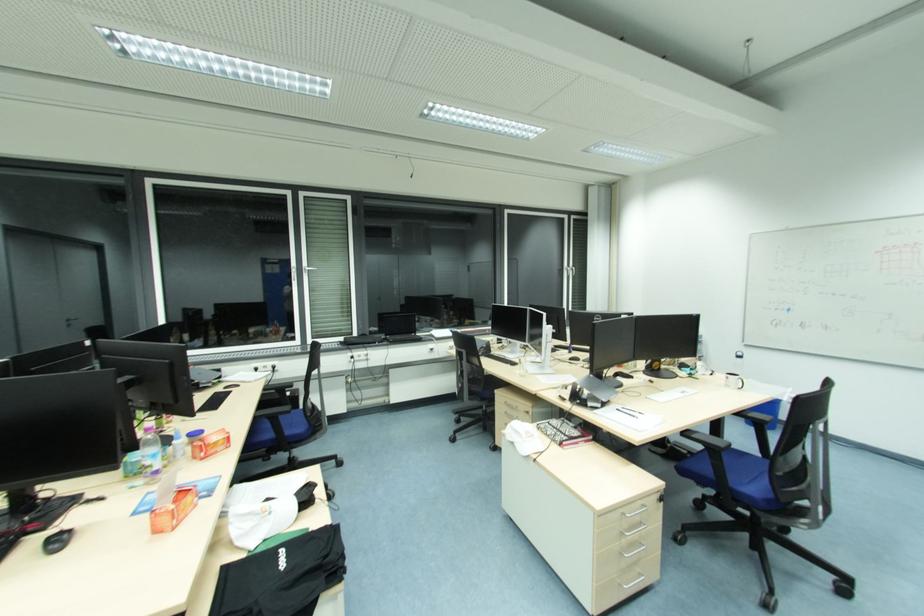
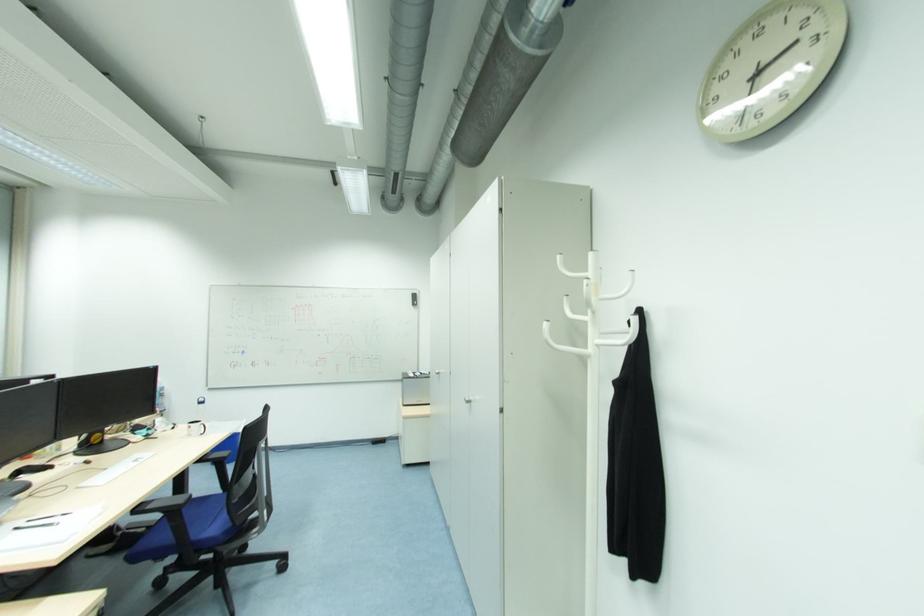
Where in the second image is the point corresponding to point (702, 358) from the first image?

(164, 413)